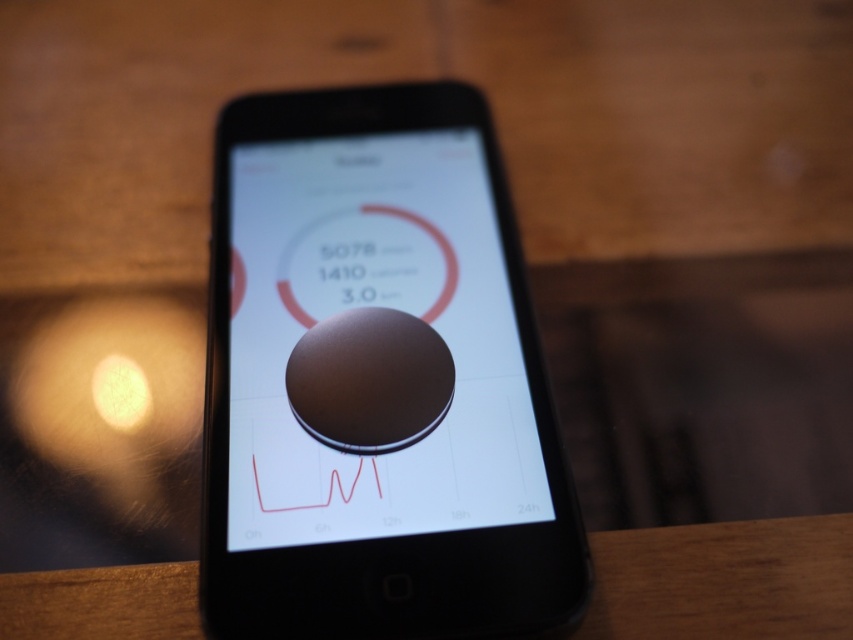
Can you confirm if matte brown circle at center is thinner than wooden table at center?

Incorrect, matte brown circle at center's width is not less than wooden table at center's.

Who is shorter, matte brown circle at center or wooden table at center?

wooden table at center

Identify the location of matte brown circle at center. This screenshot has width=853, height=640. (373, 305).

Where is `matte brown circle at center`? matte brown circle at center is located at coordinates (373, 305).